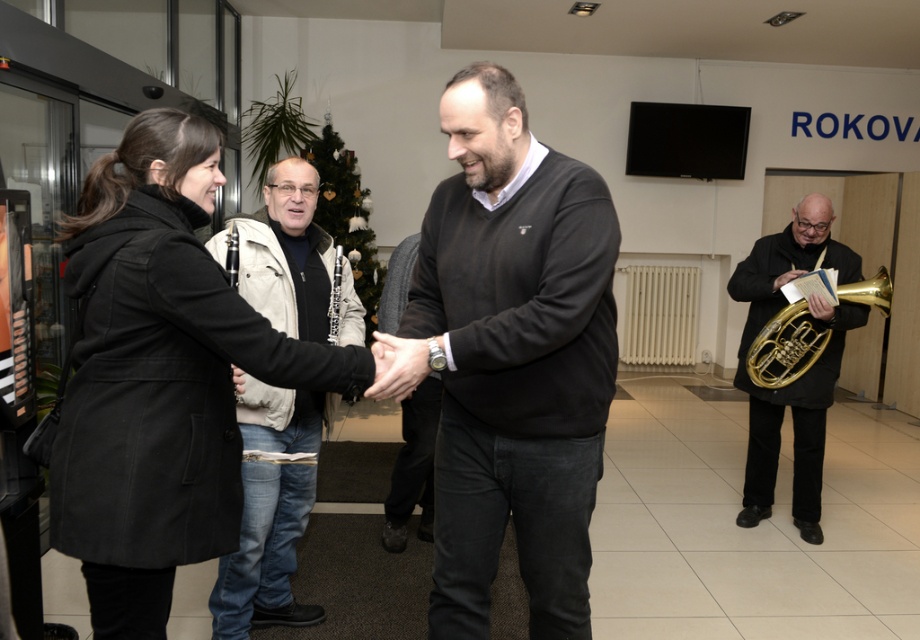
Question: Does black wool coat at left appear on the left side of light beige jacket at center?

Choices:
 (A) yes
 (B) no

Answer: (B)

Question: Considering the real-world distances, which object is closest to the black matte sweater at center?

Choices:
 (A) light beige jacket at center
 (B) black wool coat at left

Answer: (B)

Question: Estimate the real-world distances between objects in this image. Which object is farther from the gold brass tuba at right?

Choices:
 (A) black matte sweater at center
 (B) light beige jacket at center
 (C) gold brass trumpet at right

Answer: (B)

Question: From the image, what is the correct spatial relationship of black wool coat at left in relation to light beige jacket at center?

Choices:
 (A) below
 (B) above

Answer: (B)

Question: Is black wool coat at left to the right of gold brass tuba at right from the viewer's perspective?

Choices:
 (A) no
 (B) yes

Answer: (A)

Question: Which object is the farthest from the black matte sweater at center?

Choices:
 (A) gold brass trumpet at right
 (B) black wool coat at left

Answer: (A)